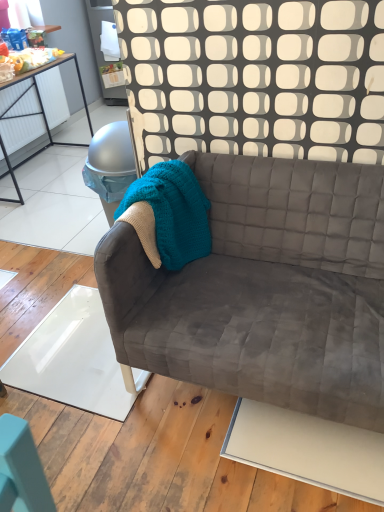
Question: Is teal knitted blanket at center further to the viewer compared to velvet gray couch at center?

Choices:
 (A) no
 (B) yes

Answer: (B)

Question: Is teal knitted blanket at center wider than velvet gray couch at center?

Choices:
 (A) no
 (B) yes

Answer: (A)

Question: Is teal knitted blanket at center closer to the viewer compared to velvet gray couch at center?

Choices:
 (A) yes
 (B) no

Answer: (B)

Question: Is teal knitted blanket at center at the right side of velvet gray couch at center?

Choices:
 (A) no
 (B) yes

Answer: (A)

Question: Is teal knitted blanket at center positioned beyond the bounds of velvet gray couch at center?

Choices:
 (A) yes
 (B) no

Answer: (B)

Question: Is teal knitted blanket at center next to velvet gray couch at center and touching it?

Choices:
 (A) no
 (B) yes

Answer: (A)

Question: Is teal knitted blanket at center surrounded by velvet gray couch at center?

Choices:
 (A) yes
 (B) no

Answer: (A)

Question: Can you confirm if velvet gray couch at center is positioned to the right of teal knitted blanket at center?

Choices:
 (A) no
 (B) yes

Answer: (B)

Question: From the image's perspective, is velvet gray couch at center beneath teal knitted blanket at center?

Choices:
 (A) no
 (B) yes

Answer: (B)

Question: Can you confirm if velvet gray couch at center is positioned to the left of teal knitted blanket at center?

Choices:
 (A) yes
 (B) no

Answer: (B)

Question: From a real-world perspective, is velvet gray couch at center physically below teal knitted blanket at center?

Choices:
 (A) no
 (B) yes

Answer: (B)

Question: Is velvet gray couch at center positioned in front of teal knitted blanket at center?

Choices:
 (A) yes
 (B) no

Answer: (A)

Question: Considering the positions of velvet gray couch at center and teal knitted blanket at center in the image, is velvet gray couch at center wider or thinner than teal knitted blanket at center?

Choices:
 (A) thin
 (B) wide

Answer: (B)